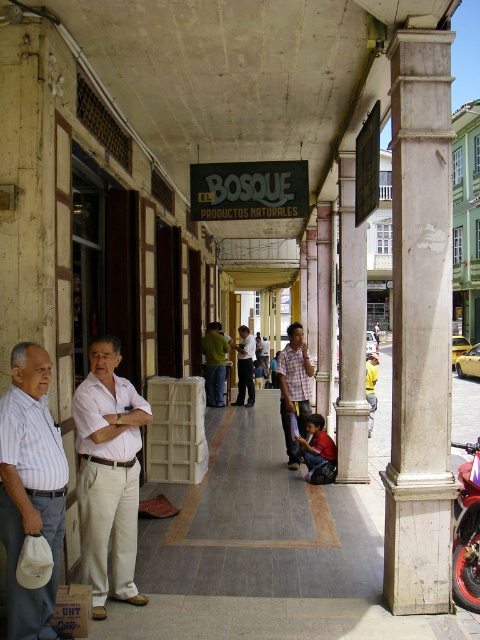
Does point (474, 472) come in front of point (264, 372)?

Yes, point (474, 472) is in front of point (264, 372).

How far apart are metallic silver motorcycle at right and light brown leather jacket at center?

The distance of metallic silver motorcycle at right from light brown leather jacket at center is 18.00 meters.

Image resolution: width=480 pixels, height=640 pixels. What are the coordinates of `metallic silver motorcycle at right` in the screenshot? It's located at (467, 531).

Where is `metallic silver motorcycle at right`? The width and height of the screenshot is (480, 640). metallic silver motorcycle at right is located at coordinates (467, 531).

Can you confirm if white marble column at center is thinner than dark blue jeans at center?

Yes.

Can you confirm if white marble column at center is shorter than dark blue jeans at center?

In fact, white marble column at center may be taller than dark blue jeans at center.

Does point (440, 244) come in front of point (301, 451)?

That is True.

Locate an element on the screen. This screenshot has width=480, height=640. white marble column at center is located at coordinates (420, 326).

Can you confirm if light pink cotton shirt at center is wider than light brown leather shirt at center?

Yes, light pink cotton shirt at center is wider than light brown leather shirt at center.

Find the location of a particular element. The image size is (480, 640). light pink cotton shirt at center is located at coordinates (108, 476).